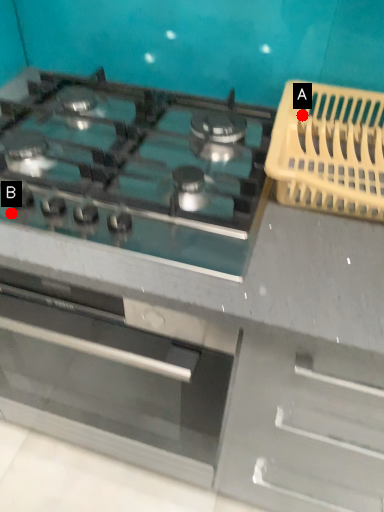
Question: Two points are circled on the image, labeled by A and B beside each circle. Which point appears closest to the camera in this image?

Choices:
 (A) A is closer
 (B) B is closer

Answer: (B)